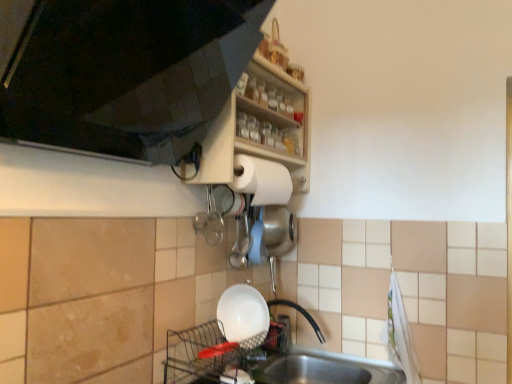
The image size is (512, 384). I want to click on white matte paper towel at upper center, so click(x=262, y=180).

The width and height of the screenshot is (512, 384). I want to click on stainless steel sink at lower center, so click(325, 369).

Where is `white matte paper towel at upper center`? Image resolution: width=512 pixels, height=384 pixels. white matte paper towel at upper center is located at coordinates (262, 180).

Identify the location of paper towel behind the wooden shelf at upper center. tap(262, 180).

From the image's perspective, which one is positioned lower, wooden shelf at upper center or white matte paper towel at upper center?

From the image's view, white matte paper towel at upper center is below.

Which of these two, wooden shelf at upper center or white matte paper towel at upper center, is smaller?

white matte paper towel at upper center is smaller.

Which of these two, white glossy bowl at lower center or stainless steel sink at lower center, is wider?

stainless steel sink at lower center.

From a real-world perspective, is white glossy bowl at lower center above or below stainless steel sink at lower center?

white glossy bowl at lower center is above stainless steel sink at lower center.

Identify the location of sink lying in front of the white glossy bowl at lower center. (325, 369).

Who is bigger, white glossy bowl at lower center or stainless steel sink at lower center?

stainless steel sink at lower center.

Is stainless steel sink at lower center looking in the opposite direction of white matte paper towel at upper center?

stainless steel sink at lower center is not turned away from white matte paper towel at upper center.

This screenshot has height=384, width=512. I want to click on sink on the right of the white matte paper towel at upper center, so click(x=325, y=369).

Considering the points (349, 364) and (273, 179), which point is in front, point (349, 364) or point (273, 179)?

The point (273, 179) is in front.

From the image's perspective, which is above, stainless steel sink at lower center or white matte paper towel at upper center?

white matte paper towel at upper center appears higher in the image.

Can you confirm if stainless steel sink at lower center is thinner than white glossy bowl at lower center?

In fact, stainless steel sink at lower center might be wider than white glossy bowl at lower center.

From a real-world perspective, is stainless steel sink at lower center located higher than white glossy bowl at lower center?

No, from a real-world perspective, stainless steel sink at lower center is not above white glossy bowl at lower center.

Does point (324, 360) come farther from viewer compared to point (256, 316)?

Yes.

Looking at this image, which object is positioned more to the right, stainless steel sink at lower center or white glossy bowl at lower center?

stainless steel sink at lower center is more to the right.

Consider the image. Considering the sizes of objects wooden shelf at upper center and stainless steel sink at lower center in the image provided, who is smaller, wooden shelf at upper center or stainless steel sink at lower center?

wooden shelf at upper center.

Looking at this image, is wooden shelf at upper center situated inside stainless steel sink at lower center or outside?

wooden shelf at upper center is outside stainless steel sink at lower center.

Are wooden shelf at upper center and stainless steel sink at lower center far apart?

No, there isn't a large distance between wooden shelf at upper center and stainless steel sink at lower center.

Considering the relative sizes of wooden shelf at upper center and stainless steel sink at lower center in the image provided, is wooden shelf at upper center wider than stainless steel sink at lower center?

No.

From the picture: Does white matte paper towel at upper center come in front of wooden shelf at upper center?

No.

From a real-world perspective, is white matte paper towel at upper center above or below wooden shelf at upper center?

From a real-world perspective, white matte paper towel at upper center is physically below wooden shelf at upper center.

Consider the image. Does white matte paper towel at upper center have a lesser width compared to wooden shelf at upper center?

Correct, the width of white matte paper towel at upper center is less than that of wooden shelf at upper center.

How different are the orientations of white matte paper towel at upper center and wooden shelf at upper center in degrees?

There is a 0.000514-degree angle between the facing directions of white matte paper towel at upper center and wooden shelf at upper center.

Considering the points (272, 204) and (234, 300), which point is behind, point (272, 204) or point (234, 300)?

Positioned behind is point (272, 204).

Between white matte paper towel at upper center and white glossy bowl at lower center, which one is positioned behind?

white matte paper towel at upper center is further from the camera.

Is white glossy bowl at lower center inside white matte paper towel at upper center?

No, white glossy bowl at lower center is not inside white matte paper towel at upper center.

From a real-world perspective, is white matte paper towel at upper center located higher than white glossy bowl at lower center?

Yes, from a real-world perspective, white matte paper towel at upper center is over white glossy bowl at lower center

The image size is (512, 384). What are the coordinates of `paper towel that appears behind the wooden shelf at upper center` in the screenshot? It's located at (262, 180).

At what (x,y) coordinates should I click in order to perform the action: click on sink that appears on the right of white glossy bowl at lower center. Please return your answer as a coordinate pair (x, y). Looking at the image, I should click on (325, 369).

From the image, which object appears to be nearer to wooden shelf at upper center, stainless steel sink at lower center or white glossy bowl at lower center?

white glossy bowl at lower center is positioned closer to the anchor wooden shelf at upper center.

Estimate the real-world distances between objects in this image. Which object is closer to white matte paper towel at upper center, matte wood shelf at upper center or stainless steel sink at lower center?

matte wood shelf at upper center.

Looking at the image, which one is located further to matte wood shelf at upper center, white glossy bowl at lower center or stainless steel sink at lower center?

Based on the image, stainless steel sink at lower center appears to be further to matte wood shelf at upper center.

In the scene shown: From the image, which object appears to be farther from wooden shelf at upper center, white glossy bowl at lower center or matte wood shelf at upper center?

The object further to wooden shelf at upper center is white glossy bowl at lower center.

Estimate the real-world distances between objects in this image. Which object is further from matte wood shelf at upper center, white glossy bowl at lower center or wooden shelf at upper center?

Based on the image, white glossy bowl at lower center appears to be further to matte wood shelf at upper center.

Based on their spatial positions, is white glossy bowl at lower center or white matte paper towel at upper center closer to stainless steel sink at lower center?

white glossy bowl at lower center is positioned closer to the anchor stainless steel sink at lower center.

Based on their spatial positions, is wooden shelf at upper center or white glossy bowl at lower center further from stainless steel sink at lower center?

wooden shelf at upper center is positioned further to the anchor stainless steel sink at lower center.

Looking at the image, which one is located closer to white glossy bowl at lower center, matte wood shelf at upper center or white matte paper towel at upper center?

The object closer to white glossy bowl at lower center is white matte paper towel at upper center.

This screenshot has height=384, width=512. I want to click on paper towel between wooden shelf at upper center and stainless steel sink at lower center in the vertical direction, so click(262, 180).

You are a GUI agent. You are given a task and a screenshot of the screen. Output one action in this format:
    pyautogui.click(x=<x>, y=<y>)
    Task: Click on the shelf between matte wood shelf at upper center and white glossy bowl at lower center in the up-down direction
    Image resolution: width=512 pixels, height=384 pixels.
    Given the screenshot: What is the action you would take?
    pyautogui.click(x=277, y=119)

At what (x,y) coordinates should I click in order to perform the action: click on basin between wooden shelf at upper center and stainless steel sink at lower center in the vertical direction. Please return your answer as a coordinate pair (x, y). Looking at the image, I should click on (242, 312).

This screenshot has height=384, width=512. In order to click on shelf between matte wood shelf at upper center and stainless steel sink at lower center in the up-down direction in this screenshot , I will do `click(277, 119)`.